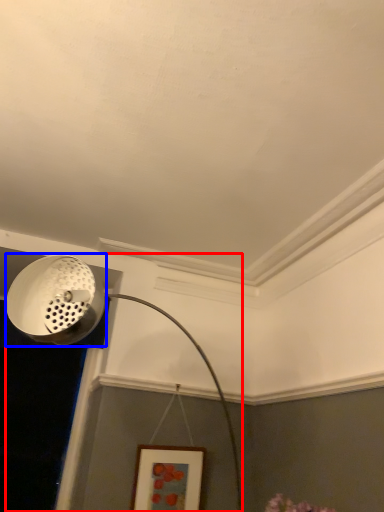
Question: Which object appears farthest to the camera in this image, lamp (highlighted by a red box) or light fixture (highlighted by a blue box)?

Choices:
 (A) lamp
 (B) light fixture

Answer: (B)